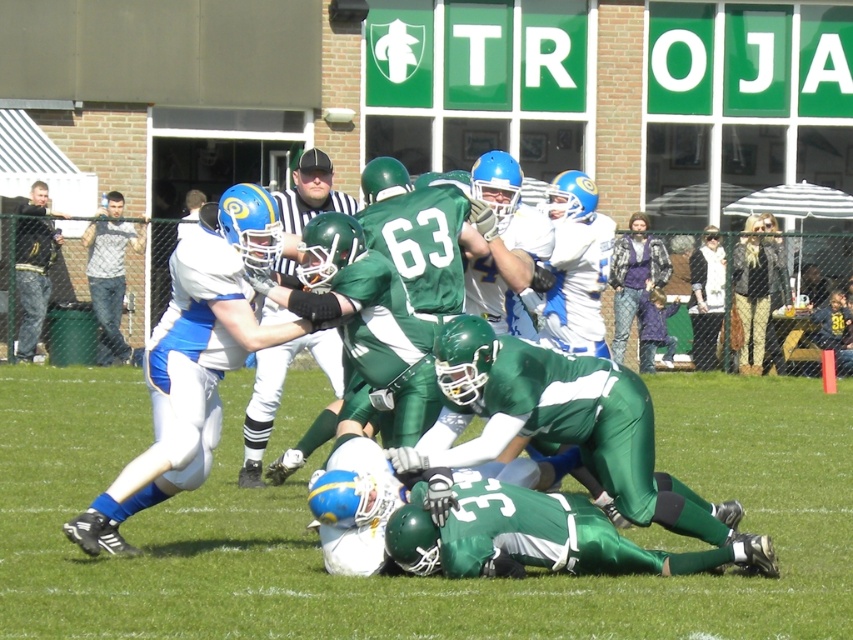
Question: Which point is closer to the camera?

Choices:
 (A) green grass football field at center
 (B) gray checkered shirt at left
 (C) shiny green helmet at center

Answer: (A)

Question: Which object is closer to the camera taking this photo?

Choices:
 (A) shiny green helmet at center
 (B) black striped shirt at center
 (C) dark gray jeans at left
 (D) green grass football field at center

Answer: (D)

Question: Is green grass football field at center below black striped shirt at center?

Choices:
 (A) no
 (B) yes

Answer: (B)

Question: Can you confirm if black striped shirt at center is thinner than gray checkered shirt at left?

Choices:
 (A) no
 (B) yes

Answer: (B)

Question: Which of the following is the farthest from the observer?

Choices:
 (A) gray checkered shirt at left
 (B) shiny green helmet at center

Answer: (A)

Question: Does gray checkered shirt at left have a lesser width compared to dark gray jeans at left?

Choices:
 (A) yes
 (B) no

Answer: (B)